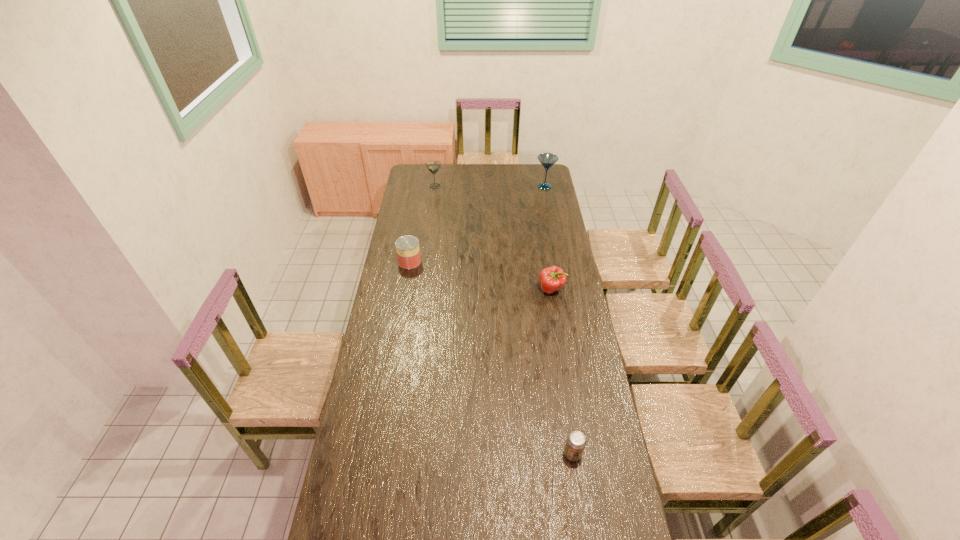
I want to click on vacant area located on the back of the beer can, so click(566, 411).

Locate an element on the screen. The width and height of the screenshot is (960, 540). martini that is at the left edge is located at coordinates (433, 166).

This screenshot has width=960, height=540. I want to click on can that is at the left edge, so click(x=407, y=247).

At what (x,y) coordinates should I click in order to perform the action: click on martini present at the right edge. Please return your answer as a coordinate pair (x, y). The image size is (960, 540). Looking at the image, I should click on click(x=547, y=160).

The image size is (960, 540). I want to click on pepper at the right edge, so click(552, 279).

Locate an element on the screen. The image size is (960, 540). beer can located at the right edge is located at coordinates (576, 441).

This screenshot has height=540, width=960. What are the coordinates of `object present at the far left corner` in the screenshot? It's located at (433, 166).

What are the coordinates of `object positioned at the far right corner` in the screenshot? It's located at (547, 160).

You are a GUI agent. You are given a task and a screenshot of the screen. Output one action in this format:
    pyautogui.click(x=<x>, y=<y>)
    Task: Click on the vacant space at the far edge
    The image size is (960, 540).
    Given the screenshot: What is the action you would take?
    pyautogui.click(x=519, y=170)

In the image, there is a desktop. At what (x,y) coordinates should I click in order to perform the action: click on vacant space at the left edge. Please return your answer as a coordinate pair (x, y). The width and height of the screenshot is (960, 540). Looking at the image, I should click on (377, 398).